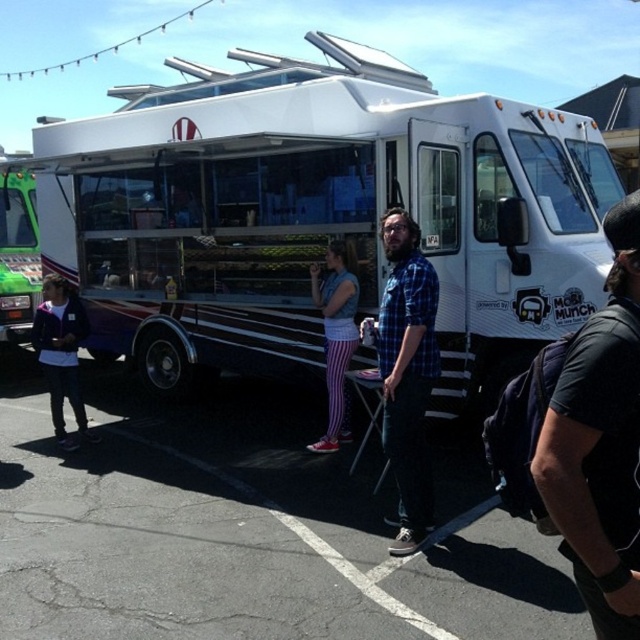
Question: Which object appears closest to the camera in this image?

Choices:
 (A) black fabric backpack at lower right
 (B) white glossy food truck at center
 (C) blue plaid shirt at center
 (D) matte purple jacket at left

Answer: (A)

Question: Is blue plaid shirt at center thinner than denim vest at center?

Choices:
 (A) no
 (B) yes

Answer: (B)

Question: Is black fabric backpack at lower right below denim vest at center?

Choices:
 (A) yes
 (B) no

Answer: (A)

Question: Which point appears farthest from the camera in this image?

Choices:
 (A) (417, 387)
 (B) (627, 230)
 (C) (284, 202)
 (D) (324, 280)

Answer: (C)

Question: Does white glossy food truck at center have a larger size compared to denim vest at center?

Choices:
 (A) yes
 (B) no

Answer: (A)

Question: Which point is closer to the camera taking this photo?

Choices:
 (A) (637, 413)
 (B) (419, 102)

Answer: (A)